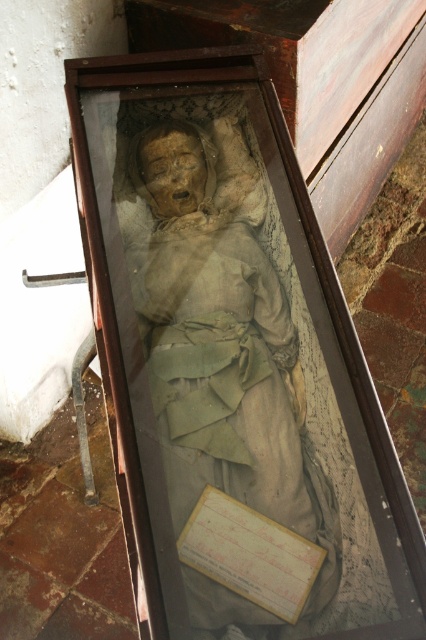
Question: Which of the following is the closest to the observer?

Choices:
 (A) (207, 128)
 (B) (190, 518)

Answer: (B)

Question: Which point is farther from the camera taking this photo?

Choices:
 (A) (261, 550)
 (B) (207, 480)

Answer: (B)

Question: Observing the image, what is the correct spatial positioning of matte brown statue at center in reference to yellow paper at center?

Choices:
 (A) below
 (B) above

Answer: (B)

Question: Is matte brown statue at center smaller than yellow paper at center?

Choices:
 (A) yes
 (B) no

Answer: (B)

Question: Where is matte brown statue at center located in relation to yellow paper at center in the image?

Choices:
 (A) left
 (B) right

Answer: (A)